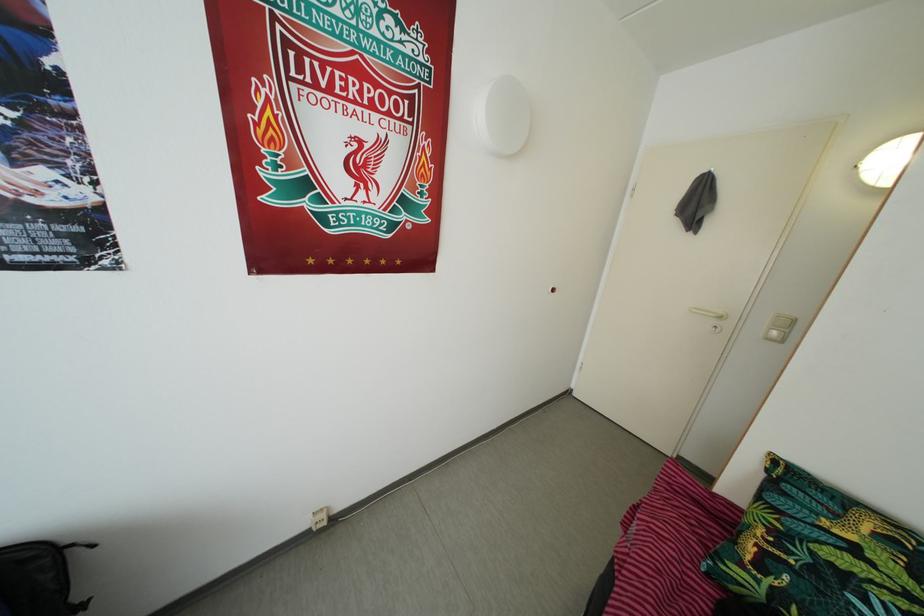
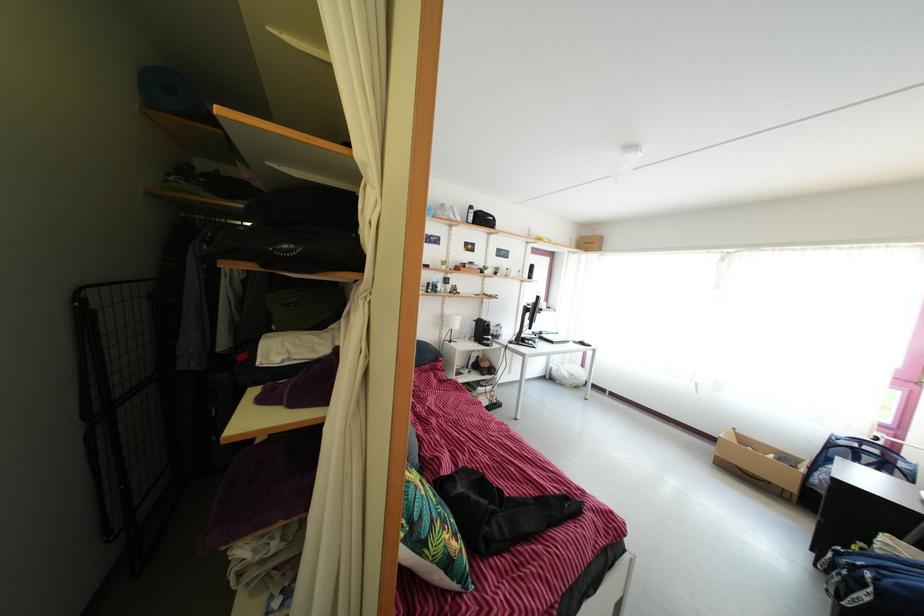
The point at (785, 520) is marked in the first image. Where is the corresponding point in the second image?

(439, 531)